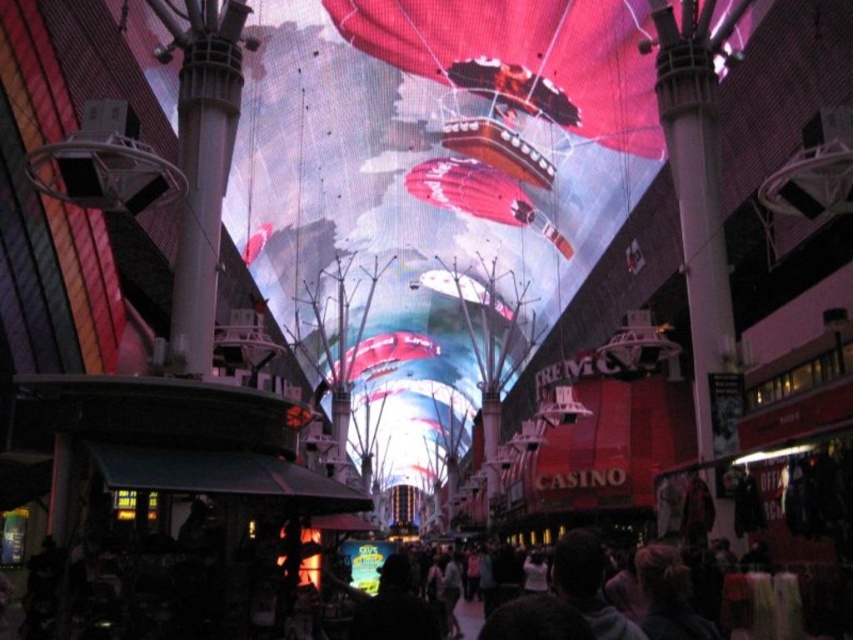
Question: Which of the following is the closest to the observer?

Choices:
 (A) (190, 186)
 (B) (489, 209)
 (C) (498, 68)

Answer: (A)

Question: Among these objects, which one is nearest to the camera?

Choices:
 (A) shiny metallic balloon at upper center
 (B) shiny metallic balloon at center

Answer: (A)

Question: From the image, what is the correct spatial relationship of shiny metallic balloon at upper center in relation to smooth gray pole at center?

Choices:
 (A) right
 (B) left

Answer: (A)

Question: Does smooth gray pole at center appear on the right side of shiny metallic balloon at center?

Choices:
 (A) no
 (B) yes

Answer: (A)

Question: Can you confirm if shiny metallic balloon at upper center is smaller than shiny metallic balloon at center?

Choices:
 (A) yes
 (B) no

Answer: (B)

Question: Among these objects, which one is nearest to the camera?

Choices:
 (A) shiny metallic balloon at upper center
 (B) shiny metallic balloon at center
 (C) smooth gray pole at center

Answer: (C)